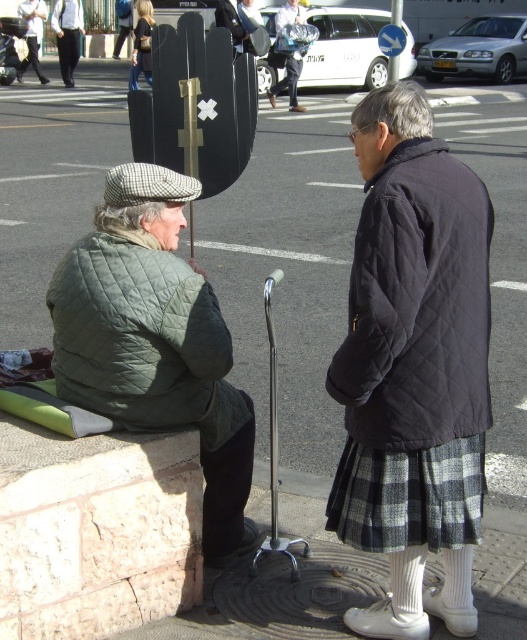
You are a pedestrian trying to cross the street. You see the quilted green jacket at left and the denim jacket at upper left. Which jacket is closer to the left side of the street?

The denim jacket at upper left is closer to the left side of the street because the quilted green jacket at left is to the right of it.

You are a tailor observing two jackets in the scene. The quilted green jacket at left and the light brown leather jacket at upper left. Which jacket has a thicker material based on their appearance?

The light brown leather jacket at upper left has a thicker material than the quilted green jacket at left.

You are a photographer trying to capture a candid shot of both the quilted green jacket at left and the light brown leather jacket at upper left. Since you want to ensure both subjects are fully visible in the frame, which jacket should you focus on to avoid cropping either of them?

The quilted green jacket at left is not as tall as the light brown leather jacket at upper left, so focusing on the light brown leather jacket at upper left ensures the shorter quilted green jacket at left will also be fully visible in the frame.